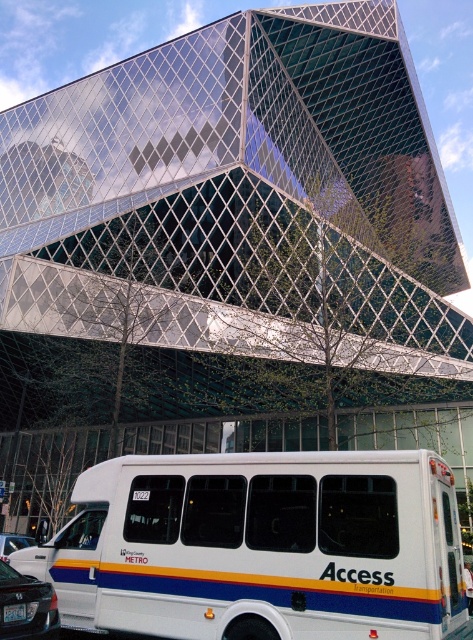
Who is shorter, white metallic van at center or metallic silver car at lower left?

metallic silver car at lower left is shorter.

Can you confirm if white metallic van at center is smaller than metallic silver car at lower left?

Incorrect, white metallic van at center is not smaller in size than metallic silver car at lower left.

Which is behind, point (120, 525) or point (32, 545)?

Positioned behind is point (32, 545).

Image resolution: width=473 pixels, height=640 pixels. In order to click on white metallic van at center in this screenshot , I will do `click(261, 547)`.

Does metallic silver sedan at lower left appear on the right side of metallic silver car at lower left?

Indeed, metallic silver sedan at lower left is positioned on the right side of metallic silver car at lower left.

Is metallic silver sedan at lower left thinner than metallic silver car at lower left?

Indeed, metallic silver sedan at lower left has a lesser width compared to metallic silver car at lower left.

Locate an element on the screen. The width and height of the screenshot is (473, 640). metallic silver sedan at lower left is located at coordinates (26, 605).

Is white metallic van at center to the left of metallic silver sedan at lower left from the viewer's perspective?

Incorrect, white metallic van at center is not on the left side of metallic silver sedan at lower left.

Is white metallic van at center bigger than metallic silver sedan at lower left?

Indeed, white metallic van at center has a larger size compared to metallic silver sedan at lower left.

Find the location of a particular element. This screenshot has height=640, width=473. white metallic van at center is located at coordinates (261, 547).